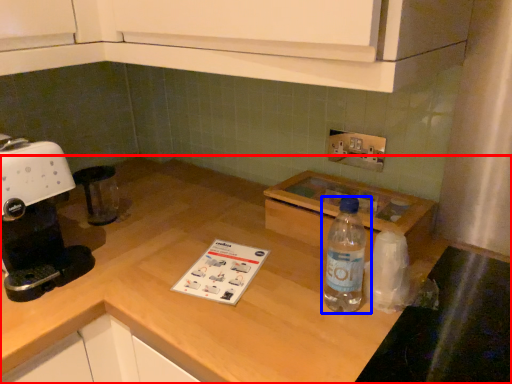
Question: Which of the following is the farthest to the observer, countertop (highlighted by a red box) or bottle (highlighted by a blue box)?

Choices:
 (A) countertop
 (B) bottle

Answer: (B)